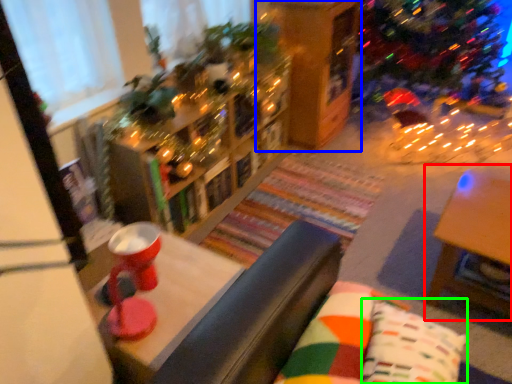
Question: Estimate the real-world distances between objects in this image. Which object is closer to table (highlighted by a red box), shelf (highlighted by a blue box) or pillow (highlighted by a green box)?

Choices:
 (A) shelf
 (B) pillow

Answer: (B)